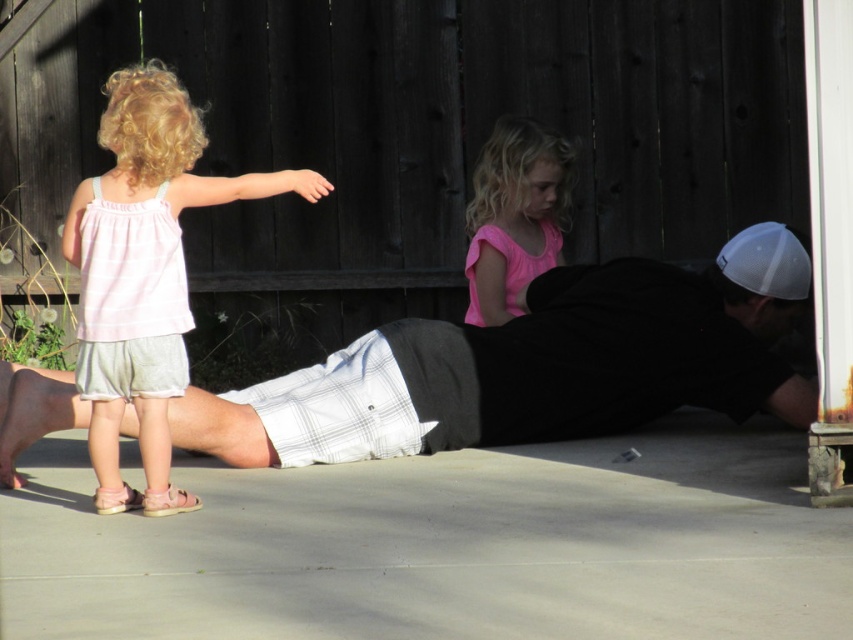
You are a photographer trying to capture a photo of both children. You notice two points in the scene marked as point 1 at [184,380] and point 2 at [502,282]. Which point should you focus on to ensure both children are in sharp focus?

You should focus on point 1 at [184,380] because it is closer to the camera than point 2 at [502,282]. This will ensure the foreground child is in focus, and the background child will also be sharp due to the depth of field.

Consider the image. You are a parent trying to dress your child in a pink fabric dress at left and a pink fabric shirt at center. Which one should you choose if you want the larger size?

The pink fabric dress at left is bigger than the pink fabric shirt at center, so you should choose the pink fabric dress at left for the larger size.